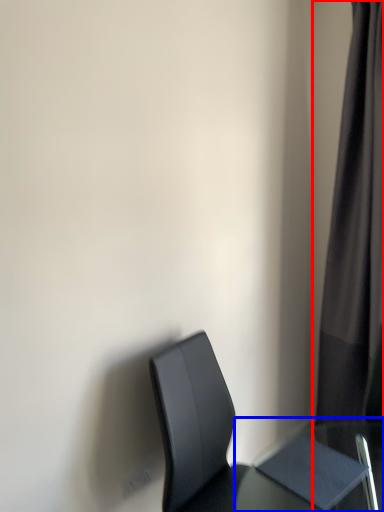
Question: Which object is further to the camera taking this photo, curtain (highlighted by a red box) or table (highlighted by a blue box)?

Choices:
 (A) curtain
 (B) table

Answer: (A)